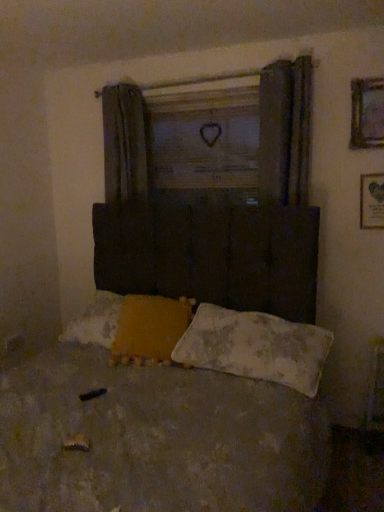
Question: Is worn fabric bed at center inside the boundaries of wooden framed picture at upper right, which is the first picture frame from top to bottom, or outside?

Choices:
 (A) outside
 (B) inside

Answer: (A)

Question: From the image's perspective, is worn fabric bed at center positioned above or below wooden framed picture at upper right, which is the first picture frame from top to bottom?

Choices:
 (A) below
 (B) above

Answer: (A)

Question: Estimate the real-world distances between objects in this image. Which object is farther from the white textured pillow at lower center, placed as the second pillow when sorted from left to right?

Choices:
 (A) wooden heart at center
 (B) worn fabric bed at center
 (C) yellow fabric pillow at lower center, the 2th pillow positioned from the right
 (D) wooden framed picture at upper right, which is the first picture frame from top to bottom
 (E) wooden framed picture at upper right, arranged as the 2th picture frame when viewed from the top

Answer: (D)

Question: Based on their relative distances, which object is farther from the worn fabric bed at center?

Choices:
 (A) wooden framed picture at upper right, the second picture frame ordered from the bottom
 (B) wooden framed picture at upper right, marked as the 1th picture frame in a bottom-to-top arrangement
 (C) white textured pillow at lower center, the 1th pillow from the right
 (D) wooden heart at center
 (E) yellow fabric pillow at lower center, the 2th pillow positioned from the right

Answer: (A)